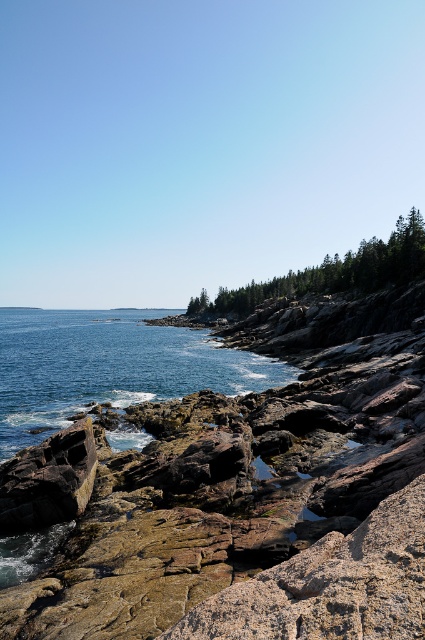
Question: Estimate the real-world distances between objects in this image. Which object is farther from the rusty rock at lower left?

Choices:
 (A) blue water at center
 (B) green textured trees at center

Answer: (B)

Question: Considering the relative positions of green textured trees at center and rusty rock at lower left in the image provided, where is green textured trees at center located with respect to rusty rock at lower left?

Choices:
 (A) left
 (B) right

Answer: (B)

Question: Does blue water at center appear on the left side of rusty rock at lower left?

Choices:
 (A) yes
 (B) no

Answer: (A)

Question: Based on their relative distances, which object is farther from the rusty rock at lower left?

Choices:
 (A) green textured trees at center
 (B) blue water at center

Answer: (A)

Question: Which point is closer to the camera?

Choices:
 (A) (57, 468)
 (B) (277, 285)
 (C) (155, 332)

Answer: (A)

Question: Is the position of blue water at center more distant than that of rusty rock at lower left?

Choices:
 (A) no
 (B) yes

Answer: (B)